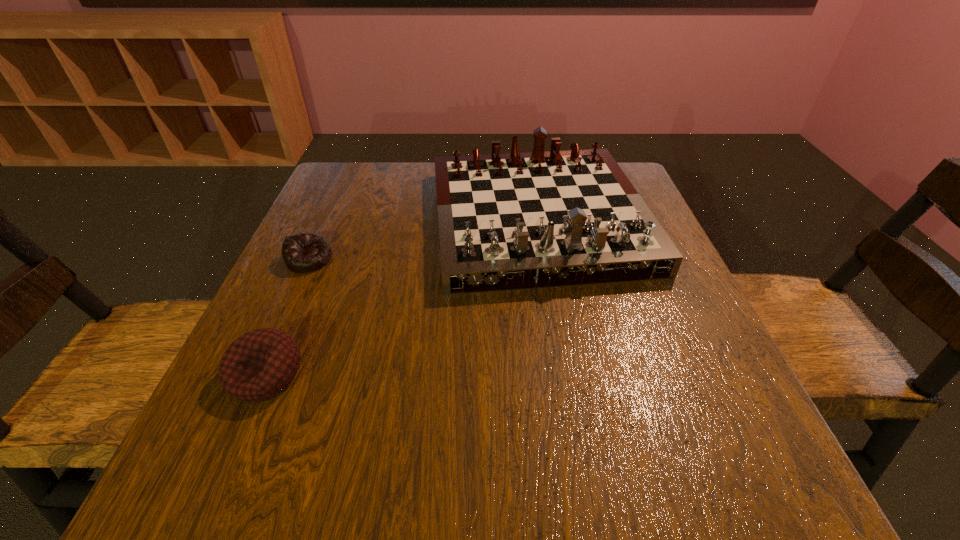
The image size is (960, 540). In order to click on object that is the second closest to the nearest object in this screenshot , I will do `click(515, 221)`.

Where is `vacant area that satisfies the following two spatial constraints: 1. on the back side of the shortest object; 2. on the left side of the tallest object`? Image resolution: width=960 pixels, height=540 pixels. vacant area that satisfies the following two spatial constraints: 1. on the back side of the shortest object; 2. on the left side of the tallest object is located at coordinates (327, 219).

This screenshot has width=960, height=540. I want to click on vacant region that satisfies the following two spatial constraints: 1. on the back side of the shortest object; 2. on the left side of the rightmost object, so click(327, 219).